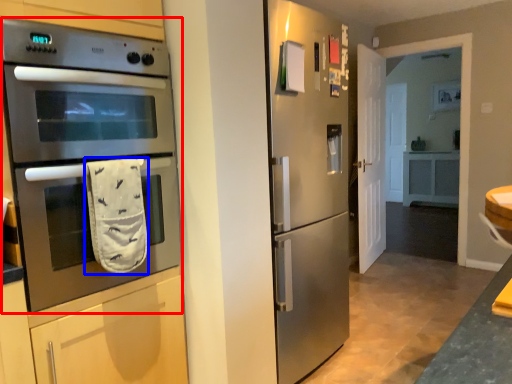
Question: Which object appears farthest to the camera in this image, microwave oven (highlighted by a red box) or hand towel (highlighted by a blue box)?

Choices:
 (A) microwave oven
 (B) hand towel

Answer: (B)